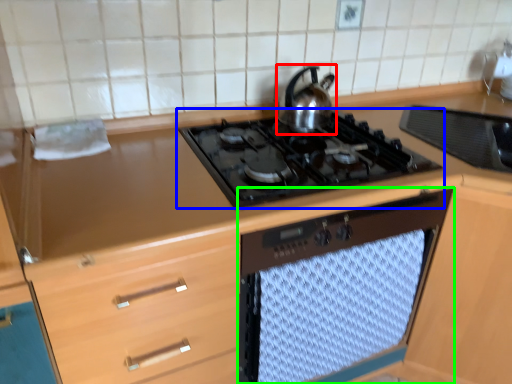
Question: Which object is positioned closest to kitchen appliance (highlighted by a red box)? Select from gas stove (highlighted by a blue box) and oven (highlighted by a green box).

Choices:
 (A) gas stove
 (B) oven

Answer: (A)